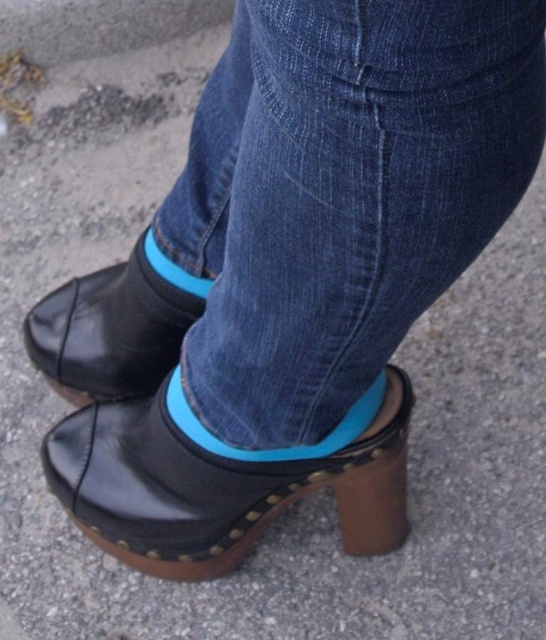
Question: Does black leather clog at lower center have a greater width compared to blue rubber sock at center?

Choices:
 (A) no
 (B) yes

Answer: (B)

Question: Which object is the farthest from the black leather clog at lower center?

Choices:
 (A) denim at center
 (B) blue rubber sock at center
 (C) black leather clog at center

Answer: (A)

Question: Which of the following is the closest to the observer?

Choices:
 (A) blue rubber sock at center
 (B) denim at center
 (C) black leather clog at center
 (D) black leather clog at lower center

Answer: (B)

Question: Does black leather clog at lower center have a greater width compared to black leather clog at center?

Choices:
 (A) yes
 (B) no

Answer: (A)

Question: Among these points, which one is farthest from the camera?

Choices:
 (A) (175, 376)
 (B) (443, 163)

Answer: (A)

Question: Does denim at center lie behind black leather clog at center?

Choices:
 (A) no
 (B) yes

Answer: (A)